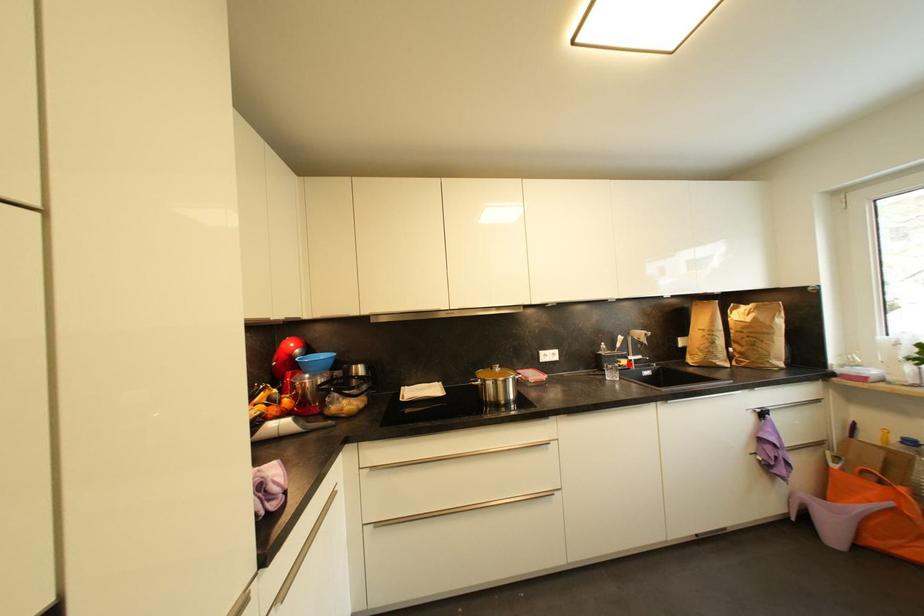
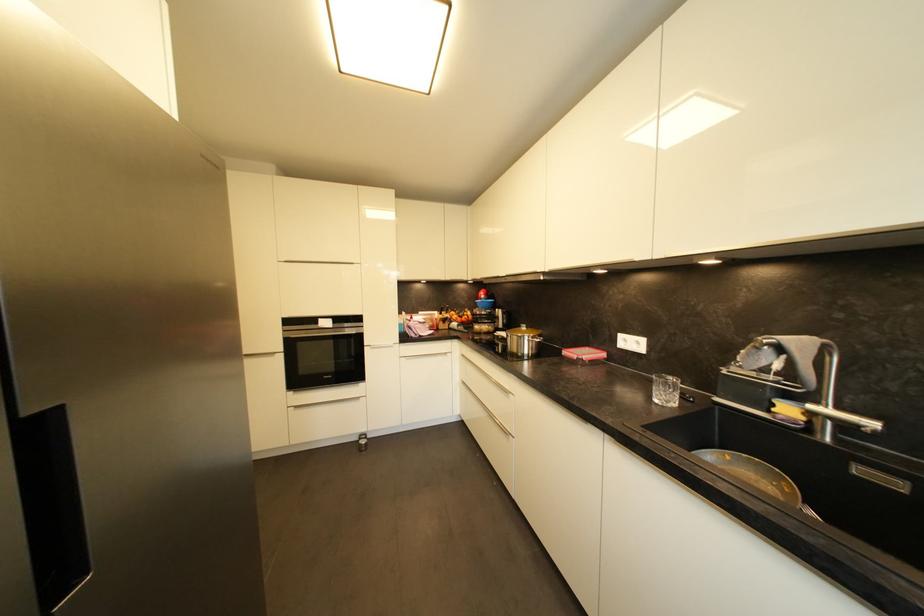
Question: I am providing you with two images of the same scene from different viewpoints. Given a red point in image1, look at the same physical point in image2. Is it:

Choices:
 (A) Closer to the viewpoint
 (B) Farther from the viewpoint

Answer: (A)